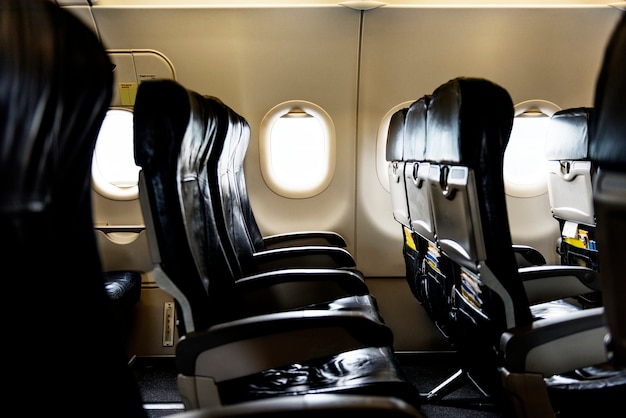
Locate an element on the screen. windows is located at coordinates (120, 151), (289, 146), (386, 127), (535, 127).